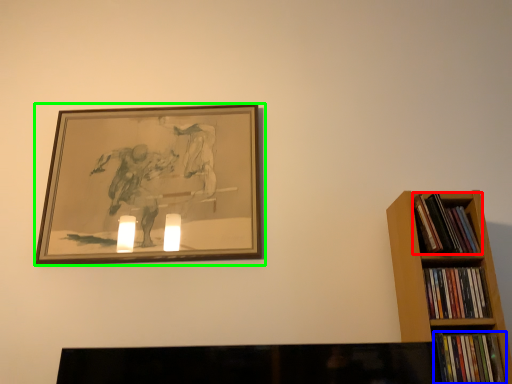
Question: Which object is positioned closest to book (highlighted by a red box)? Select from book (highlighted by a blue box) and picture frame (highlighted by a green box).

Choices:
 (A) book
 (B) picture frame

Answer: (A)